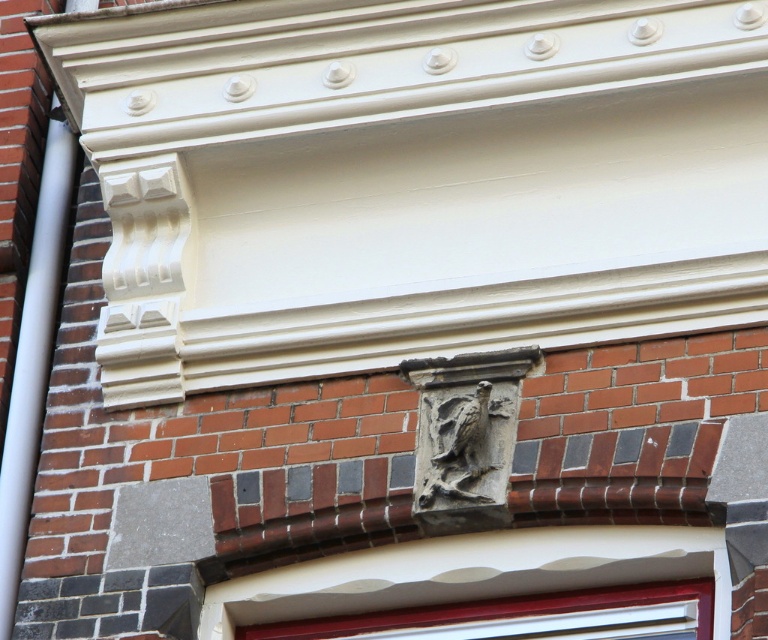
You are an architect inspecting the building facade. You notice the white painted wood at lower center and the gray stone eagle at center. Which of these two elements is bigger in size?

The white painted wood at lower center is larger in size than the gray stone eagle at center.

You are standing in front of a building and see the white painted wood at lower center and the gray stone eagle at center. Which object is nearer to you?

The white painted wood at lower center is closer to the viewer than the gray stone eagle at center.

You are an architect inspecting the building facade. You notice the white painted wood at lower center and the gray stone eagle at center. Which object is located below the other?

The white painted wood at lower center is positioned under the gray stone eagle at center, meaning it is located below the gray stone eagle at center.